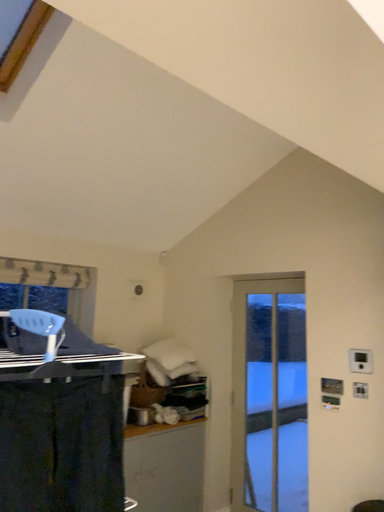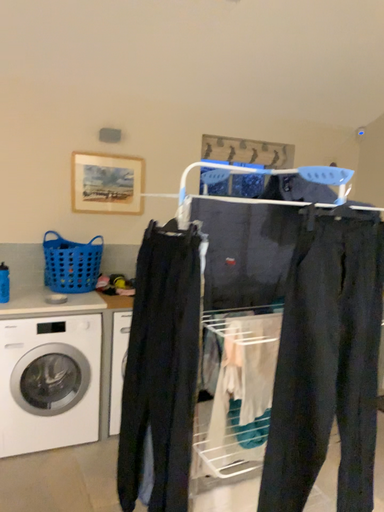
Question: Which way did the camera rotate in the video?

Choices:
 (A) rotated right
 (B) rotated left

Answer: (B)